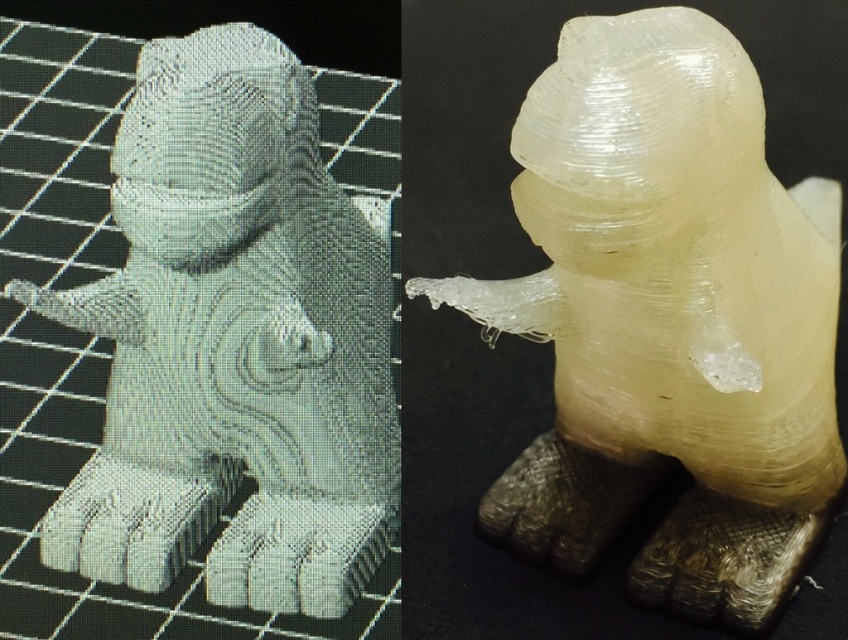
You are an artist examining two 3D models displayed on a screen. You see a translucent white sculpture at center and a white glossy statue at center. Which one appears nearer to you on the screen?

The translucent white sculpture at center appears nearer to you because it is closer to the viewer than the white glossy statue at center.

Based on the photo, you are an art curator examining two 3D printed models displayed in a gallery. The first model is a translucent white sculpture at center, and the second is a white glossy statue at center. Based on their dimensions, which model would require a wider base to prevent tipping over?

The translucent white sculpture at center requires a wider base because its width surpasses that of the white glossy statue at center, making it potentially less stable without adequate support.

You are an art curator examining two 3D printed dinosaur models displayed in a gallery. You notice a translucent white sculpture at center and a white glossy statue at center. Which one is positioned higher in the display?

The translucent white sculpture at center is positioned higher than the white glossy statue at center.